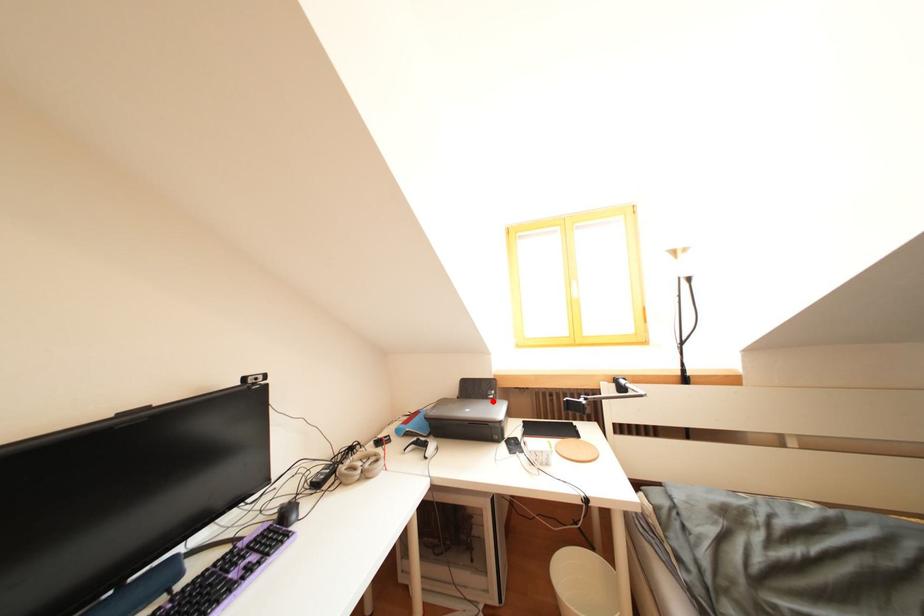
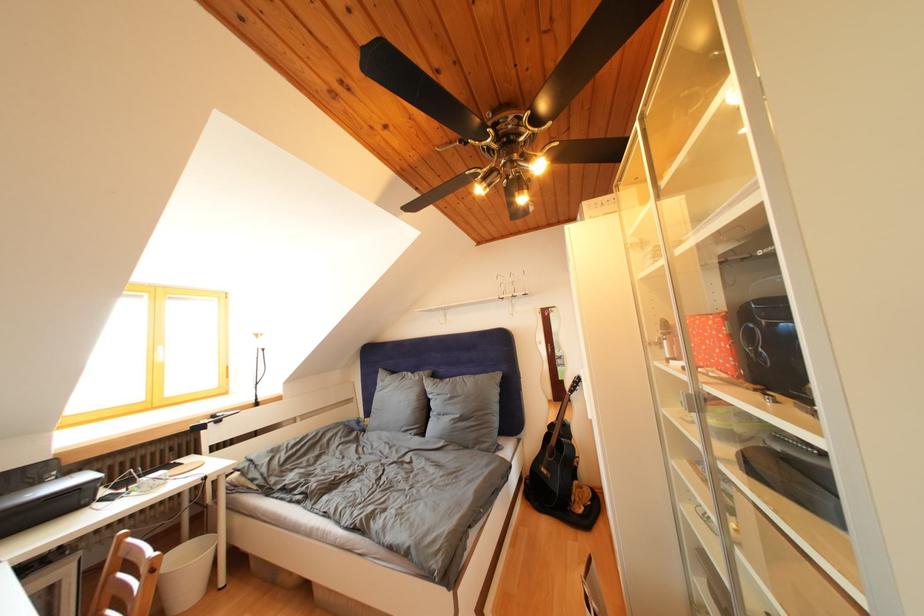
In the second image, find the point that corresponds to the highlighted location in the first image.

(44, 488)